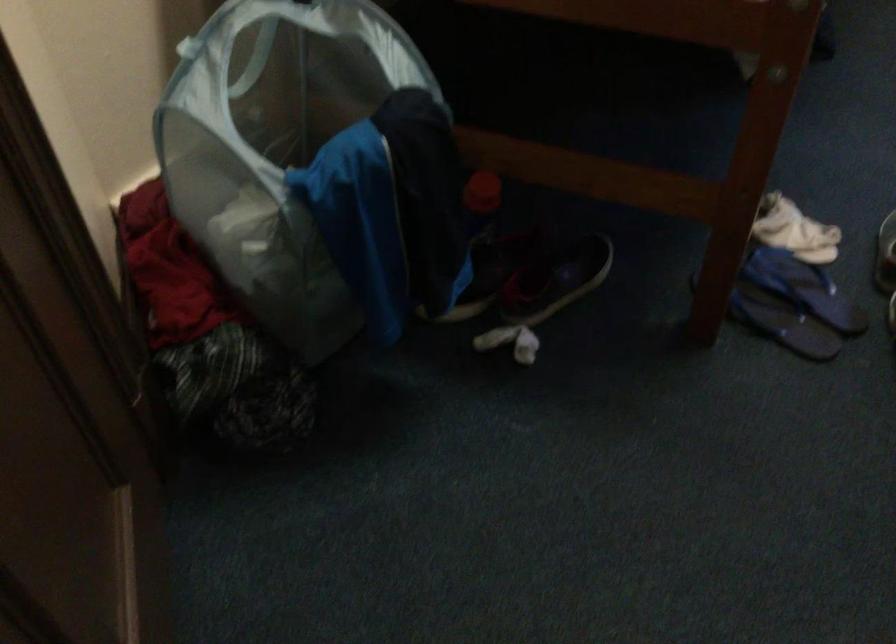
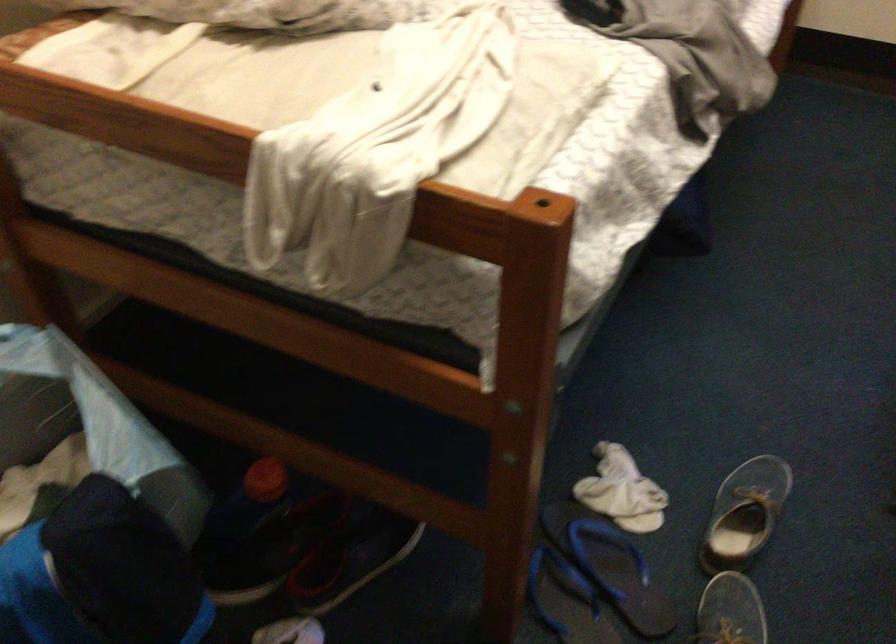
Where in the second image is the point corresponding to point (483, 190) from the first image?

(264, 480)